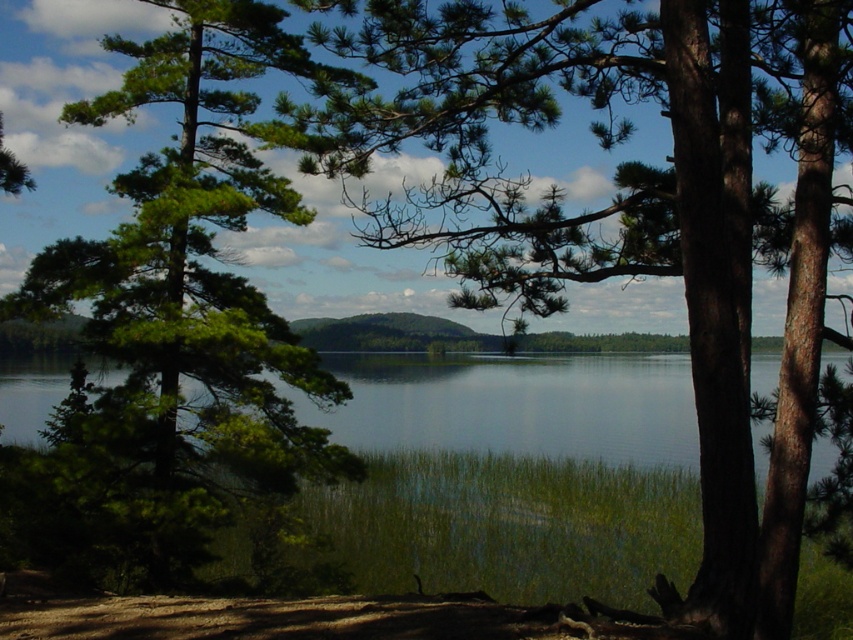
Consider the image. Can you confirm if green needle-like leaves at center-left is wider than green grassy water at lower center?

No, green needle-like leaves at center-left is not wider than green grassy water at lower center.

Does point (380, 129) lie behind point (9, 406)?

No, (380, 129) is in front of (9, 406).

Is point (627, 161) more distant than point (525, 404)?

No, (627, 161) is closer to viewer.

You are a GUI agent. You are given a task and a screenshot of the screen. Output one action in this format:
    pyautogui.click(x=<x>, y=<y>)
    Task: Click on the green needle-like leaves at center-left
    
    Given the screenshot: What is the action you would take?
    pyautogui.click(x=628, y=211)

Between point (630, 230) and point (131, 481), which one is positioned behind?

The point (630, 230) is more distant.

Between point (521, 234) and point (256, 376), which one is positioned in front?

Point (521, 234) is in front.

Where is `green needle-like leaves at center-left`? green needle-like leaves at center-left is located at coordinates (628, 211).

Is green needle-like at left bigger than green grassy water at lower center?

Yes, green needle-like at left is bigger than green grassy water at lower center.

This screenshot has width=853, height=640. Identify the location of green needle-like at left. (175, 321).

You are a GUI agent. You are given a task and a screenshot of the screen. Output one action in this format:
    pyautogui.click(x=<x>, y=<y>)
    Task: Click on the green needle-like at left
    The width and height of the screenshot is (853, 640).
    Given the screenshot: What is the action you would take?
    pyautogui.click(x=175, y=321)